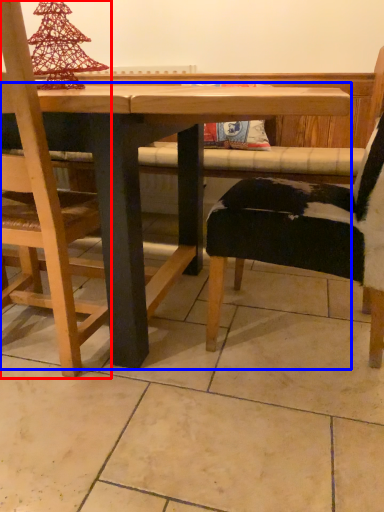
Question: Which object appears farthest to the camera in this image, chair (highlighted by a red box) or table (highlighted by a blue box)?

Choices:
 (A) chair
 (B) table

Answer: (A)